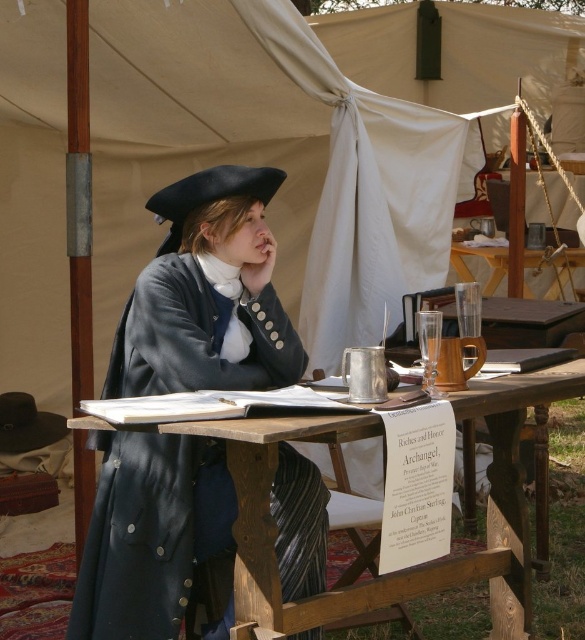
Is matte black coat at center to the right of wooden picnic table at center from the viewer's perspective?

No, matte black coat at center is not to the right of wooden picnic table at center.

Is matte black coat at center smaller than wooden picnic table at center?

Indeed, matte black coat at center has a smaller size compared to wooden picnic table at center.

Does point (113, 456) come closer to viewer compared to point (304, 624)?

No, (113, 456) is further to viewer.

What are the coordinates of `matte black coat at center` in the screenshot? It's located at (208, 294).